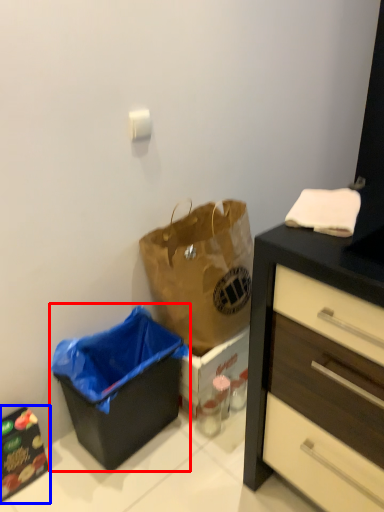
Question: Which object is further to the camera taking this photo, recycling bin (highlighted by a red box) or cabinetry (highlighted by a blue box)?

Choices:
 (A) recycling bin
 (B) cabinetry

Answer: (B)